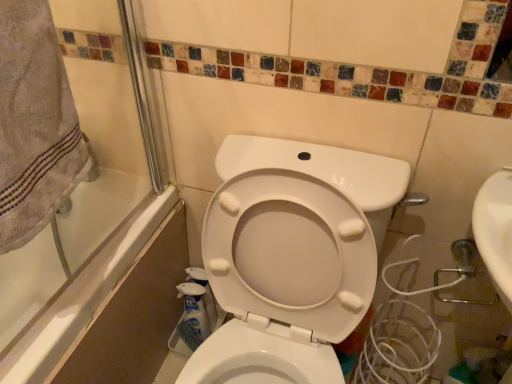
The height and width of the screenshot is (384, 512). I want to click on white glossy bathtub at left, so click(87, 268).

Identify the location of translucent plastic spray bottle at lower center, placed as the second cleaning product when sorted from back to front. The image size is (512, 384). (193, 315).

What is the approximate width of translucent plastic spray bottle at lower center, the 1th cleaning product when ordered from front to back?

translucent plastic spray bottle at lower center, the 1th cleaning product when ordered from front to back, is 1.81 inches in width.

You are a GUI agent. You are given a task and a screenshot of the screen. Output one action in this format:
    pyautogui.click(x=<x>, y=<y>)
    Task: Click on the white glossy bottle at lower center, the second cleaning product from the front
    
    Given the screenshot: What is the action you would take?
    pyautogui.click(x=205, y=293)

Is white glossy bathtub at left not near translucent plastic spray bottle at lower center, the 1th cleaning product when ordered from front to back?

No, white glossy bathtub at left is in close proximity to translucent plastic spray bottle at lower center, the 1th cleaning product when ordered from front to back.

From the image's perspective, is white glossy bathtub at left above or below translucent plastic spray bottle at lower center, placed as the second cleaning product when sorted from back to front?

white glossy bathtub at left is above translucent plastic spray bottle at lower center, placed as the second cleaning product when sorted from back to front.

Is white glossy bathtub at left closer to camera compared to translucent plastic spray bottle at lower center, placed as the second cleaning product when sorted from back to front?

Yes, it is in front of translucent plastic spray bottle at lower center, placed as the second cleaning product when sorted from back to front.

Based on the photo, from a real-world perspective, who is located higher, white glossy bathtub at left or translucent plastic spray bottle at lower center, placed as the second cleaning product when sorted from back to front?

white glossy bathtub at left is physically above.

Is white glossy bathtub at left located within beige cotton towel at upper left?

No, white glossy bathtub at left is not inside beige cotton towel at upper left.

Does beige cotton towel at upper left have a greater height compared to white glossy bathtub at left?

In fact, beige cotton towel at upper left may be shorter than white glossy bathtub at left.

Considering the points (53, 212) and (56, 331), which point is in front, point (53, 212) or point (56, 331)?

Positioned in front is point (53, 212).

What are the coordinates of `bath towel above the translucent plastic spray bottle at lower center, the 1th cleaning product when ordered from front to back (from a real-world perspective)` in the screenshot? It's located at (34, 124).

From the image's perspective, who appears lower, beige cotton towel at upper left or translucent plastic spray bottle at lower center, placed as the second cleaning product when sorted from back to front?

translucent plastic spray bottle at lower center, placed as the second cleaning product when sorted from back to front, appears lower in the image.

Is beige cotton towel at upper left oriented towards translucent plastic spray bottle at lower center, placed as the second cleaning product when sorted from back to front?

No, beige cotton towel at upper left does not turn towards translucent plastic spray bottle at lower center, placed as the second cleaning product when sorted from back to front.

Is beige cotton towel at upper left surrounding translucent plastic spray bottle at lower center, the 1th cleaning product when ordered from front to back?

No, translucent plastic spray bottle at lower center, the 1th cleaning product when ordered from front to back, is not inside beige cotton towel at upper left.

Is white glossy bottle at lower center, marked as the first cleaning product in a back-to-front arrangement, completely or partially inside white glossy bathtub at left?

That's incorrect, white glossy bottle at lower center, marked as the first cleaning product in a back-to-front arrangement, is not inside white glossy bathtub at left.

From the image's perspective, is white glossy bathtub at left over white glossy bottle at lower center, marked as the first cleaning product in a back-to-front arrangement?

Indeed, from the image's perspective, white glossy bathtub at left is shown above white glossy bottle at lower center, marked as the first cleaning product in a back-to-front arrangement.

From a real-world perspective, is white glossy bathtub at left on top of white glossy bottle at lower center, the second cleaning product from the front?

Correct, in the physical world, white glossy bathtub at left is higher than white glossy bottle at lower center, the second cleaning product from the front.

Is white glossy bathtub at left wider than white glossy bottle at lower center, the second cleaning product from the front?

Indeed, white glossy bathtub at left has a greater width compared to white glossy bottle at lower center, the second cleaning product from the front.

Between translucent plastic spray bottle at lower center, the 1th cleaning product when ordered from front to back, and white glossy bathtub at left, which one has less height?

Standing shorter between the two is translucent plastic spray bottle at lower center, the 1th cleaning product when ordered from front to back.

Is translucent plastic spray bottle at lower center, placed as the second cleaning product when sorted from back to front, to the right of white glossy bathtub at left from the viewer's perspective?

Correct, you'll find translucent plastic spray bottle at lower center, placed as the second cleaning product when sorted from back to front, to the right of white glossy bathtub at left.

Is translucent plastic spray bottle at lower center, placed as the second cleaning product when sorted from back to front, outside of white glossy bathtub at left?

Yes.

How distant is translucent plastic spray bottle at lower center, placed as the second cleaning product when sorted from back to front, from white glossy bathtub at left?

translucent plastic spray bottle at lower center, placed as the second cleaning product when sorted from back to front, is 14.95 inches away from white glossy bathtub at left.

From a real-world perspective, is beige cotton towel at upper left physically below white glossy bottle at lower center, the second cleaning product from the front?

Incorrect, from a real-world perspective, beige cotton towel at upper left is higher than white glossy bottle at lower center, the second cleaning product from the front.

In the scene shown: Is beige cotton towel at upper left facing towards white glossy bottle at lower center, marked as the first cleaning product in a back-to-front arrangement?

No, beige cotton towel at upper left is not turned towards white glossy bottle at lower center, marked as the first cleaning product in a back-to-front arrangement.

Who is smaller, beige cotton towel at upper left or white glossy bottle at lower center, marked as the first cleaning product in a back-to-front arrangement?

Smaller between the two is white glossy bottle at lower center, marked as the first cleaning product in a back-to-front arrangement.

Considering the positions of objects beige cotton towel at upper left and white glossy bottle at lower center, the second cleaning product from the front, in the image provided, who is behind, beige cotton towel at upper left or white glossy bottle at lower center, the second cleaning product from the front,?

white glossy bottle at lower center, the second cleaning product from the front.

Which of these two, white glossy bathtub at left or beige cotton towel at upper left, is bigger?

white glossy bathtub at left is bigger.

Is white glossy bathtub at left facing away from beige cotton towel at upper left?

Yes, beige cotton towel at upper left is at the back of white glossy bathtub at left.

Consider the image. Is white glossy bathtub at left to the left of beige cotton towel at upper left from the viewer's perspective?

Yes, white glossy bathtub at left is to the left of beige cotton towel at upper left.

Where is `bath in front of the translucent plastic spray bottle at lower center, the 1th cleaning product when ordered from front to back`? Image resolution: width=512 pixels, height=384 pixels. bath in front of the translucent plastic spray bottle at lower center, the 1th cleaning product when ordered from front to back is located at coordinates (87, 268).

Locate an element on the screen. The width and height of the screenshot is (512, 384). bath below the beige cotton towel at upper left (from the image's perspective) is located at coordinates (87, 268).

Which object lies further to the anchor point white glossy bottle at lower center, the second cleaning product from the front, translucent plastic spray bottle at lower center, placed as the second cleaning product when sorted from back to front, or beige cotton towel at upper left?

beige cotton towel at upper left is further to white glossy bottle at lower center, the second cleaning product from the front.

Which object lies nearer to the anchor point white glossy bathtub at left, white glossy bottle at lower center, the second cleaning product from the front, or translucent plastic spray bottle at lower center, placed as the second cleaning product when sorted from back to front?

white glossy bottle at lower center, the second cleaning product from the front, is positioned closer to the anchor white glossy bathtub at left.

Looking at the image, which one is located closer to white glossy bathtub at left, beige cotton towel at upper left or translucent plastic spray bottle at lower center, the 1th cleaning product when ordered from front to back?

translucent plastic spray bottle at lower center, the 1th cleaning product when ordered from front to back, is positioned closer to the anchor white glossy bathtub at left.

Estimate the real-world distances between objects in this image. Which object is further from translucent plastic spray bottle at lower center, the 1th cleaning product when ordered from front to back, beige cotton towel at upper left or white glossy bottle at lower center, the second cleaning product from the front?

beige cotton towel at upper left is positioned further to the anchor translucent plastic spray bottle at lower center, the 1th cleaning product when ordered from front to back.

Looking at the image, which one is located further to translucent plastic spray bottle at lower center, the 1th cleaning product when ordered from front to back, white glossy bathtub at left or beige cotton towel at upper left?

The object further to translucent plastic spray bottle at lower center, the 1th cleaning product when ordered from front to back, is beige cotton towel at upper left.

From the image, which object appears to be farther from beige cotton towel at upper left, white glossy bottle at lower center, the second cleaning product from the front, or white glossy bathtub at left?

Based on the image, white glossy bottle at lower center, the second cleaning product from the front, appears to be further to beige cotton towel at upper left.

From the image, which object appears to be nearer to translucent plastic spray bottle at lower center, placed as the second cleaning product when sorted from back to front, white glossy bathtub at left or white glossy bottle at lower center, marked as the first cleaning product in a back-to-front arrangement?

white glossy bottle at lower center, marked as the first cleaning product in a back-to-front arrangement, is positioned closer to the anchor translucent plastic spray bottle at lower center, placed as the second cleaning product when sorted from back to front.

Looking at the image, which one is located further to white glossy bottle at lower center, marked as the first cleaning product in a back-to-front arrangement, white glossy bathtub at left or beige cotton towel at upper left?

The object further to white glossy bottle at lower center, marked as the first cleaning product in a back-to-front arrangement, is beige cotton towel at upper left.

In order to click on cleaning product between beige cotton towel at upper left and white glossy bottle at lower center, marked as the first cleaning product in a back-to-front arrangement, along the z-axis in this screenshot , I will do `click(193, 315)`.

Locate an element on the screen. bath towel between white glossy bathtub at left and white glossy bottle at lower center, marked as the first cleaning product in a back-to-front arrangement, from front to back is located at coordinates (34, 124).

The height and width of the screenshot is (384, 512). Identify the location of cleaning product positioned between white glossy bathtub at left and white glossy bottle at lower center, marked as the first cleaning product in a back-to-front arrangement, from near to far. (193, 315).

The height and width of the screenshot is (384, 512). I want to click on bath towel between white glossy bathtub at left and translucent plastic spray bottle at lower center, placed as the second cleaning product when sorted from back to front, from front to back, so click(34, 124).